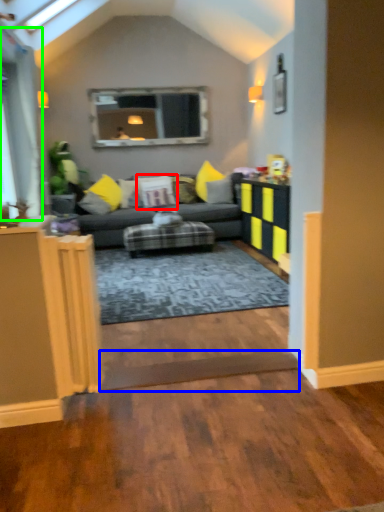
Question: Considering the real-world distances, which object is farthest from pillow (highlighted by a red box)? plank (highlighted by a blue box) or glass door (highlighted by a green box)?

Choices:
 (A) plank
 (B) glass door

Answer: (A)